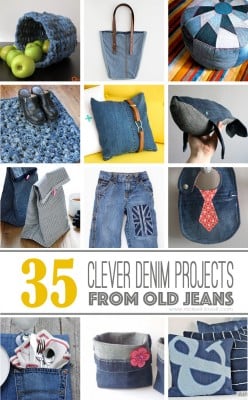
At what (x,y) coordinates should I click in order to perform the action: click on cushion. Please return your answer as a coordinate pair (x, y). Looking at the image, I should click on (217, 35).